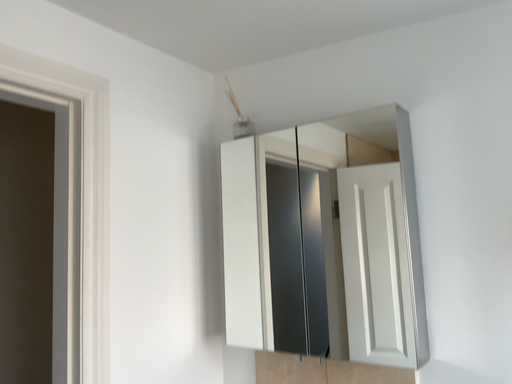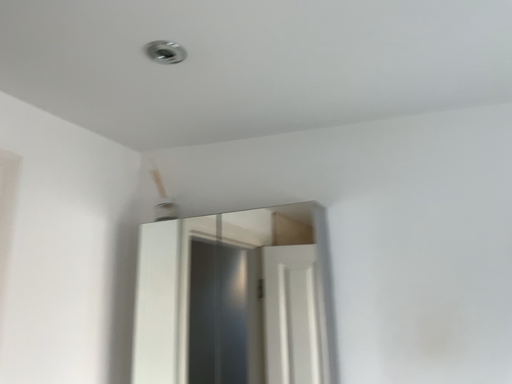
Question: How did the camera likely rotate when shooting the video?

Choices:
 (A) rotated right
 (B) rotated left

Answer: (A)